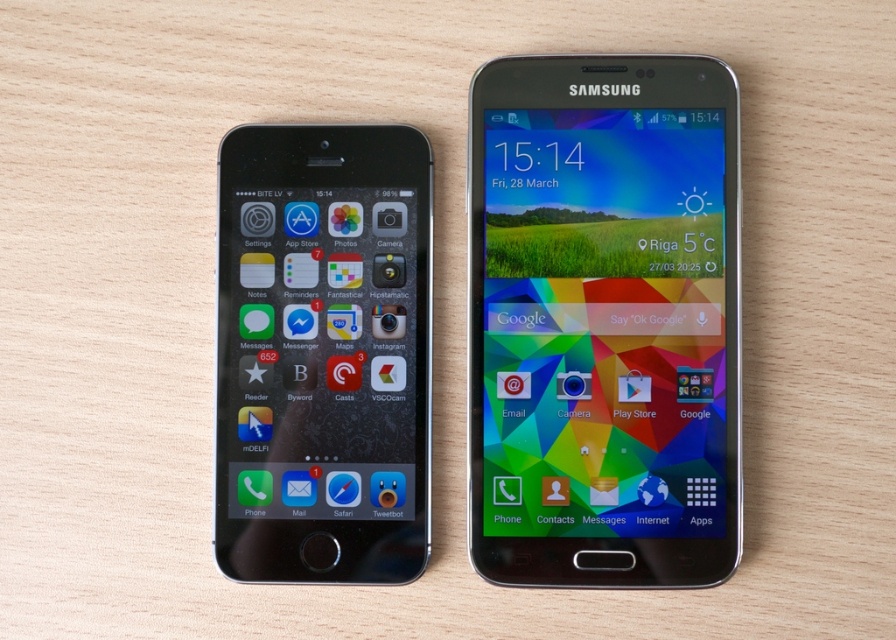
Question: Does metallic samsung smartphone at center appear on the right side of matte black phone at left?

Choices:
 (A) no
 (B) yes

Answer: (B)

Question: Which of the following is the farthest from the observer?

Choices:
 (A) matte black phone at left
 (B) metallic samsung smartphone at center

Answer: (A)

Question: Which object is farther from the camera taking this photo?

Choices:
 (A) metallic samsung smartphone at center
 (B) matte black phone at left

Answer: (B)

Question: Which point is closer to the camera?

Choices:
 (A) (629, 186)
 (B) (421, 324)

Answer: (B)

Question: Considering the relative positions of metallic samsung smartphone at center and matte black phone at left in the image provided, where is metallic samsung smartphone at center located with respect to matte black phone at left?

Choices:
 (A) above
 (B) below

Answer: (A)

Question: Can you confirm if metallic samsung smartphone at center is positioned above matte black phone at left?

Choices:
 (A) yes
 (B) no

Answer: (A)